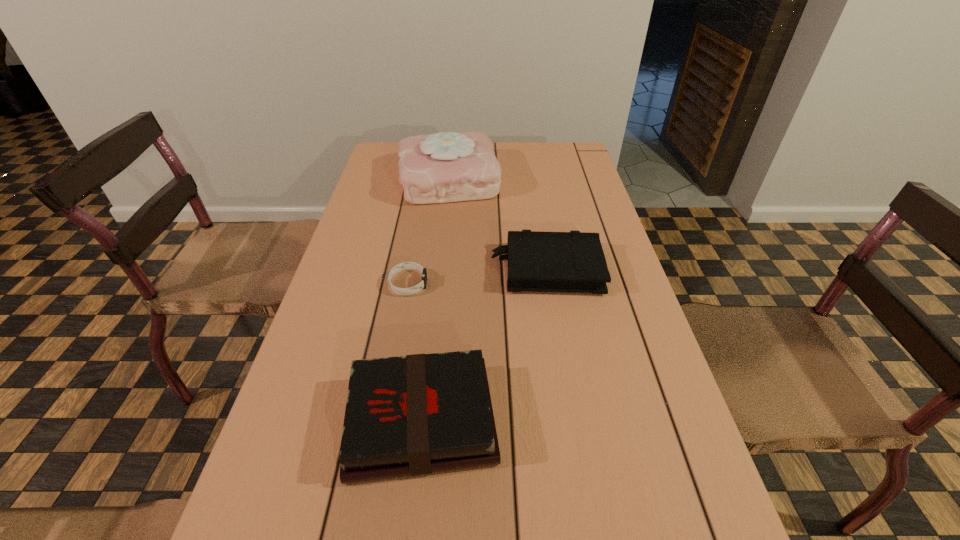
Find the location of a particular element. This screenshot has width=960, height=540. cake situated at the left edge is located at coordinates (443, 167).

Find the location of a particular element. The width and height of the screenshot is (960, 540). hardback book present at the left edge is located at coordinates (417, 414).

Image resolution: width=960 pixels, height=540 pixels. I want to click on wristband that is at the left edge, so click(x=406, y=265).

Identify the location of object at the right edge. This screenshot has width=960, height=540. (574, 261).

Image resolution: width=960 pixels, height=540 pixels. Identify the location of object that is positioned at the far left corner. (443, 167).

Locate an element on the screen. This screenshot has width=960, height=540. vacant space at the left edge is located at coordinates (356, 295).

Find the location of `free space at the right edge of the desktop`. free space at the right edge of the desktop is located at coordinates (622, 338).

Where is `free spot at the far right corner of the desktop`? free spot at the far right corner of the desktop is located at coordinates (574, 167).

Locate an element on the screen. The image size is (960, 540). vacant area between the hardback book and the cake is located at coordinates (435, 300).

Identify the location of free space between the farthest object and the nearest object. (435, 300).